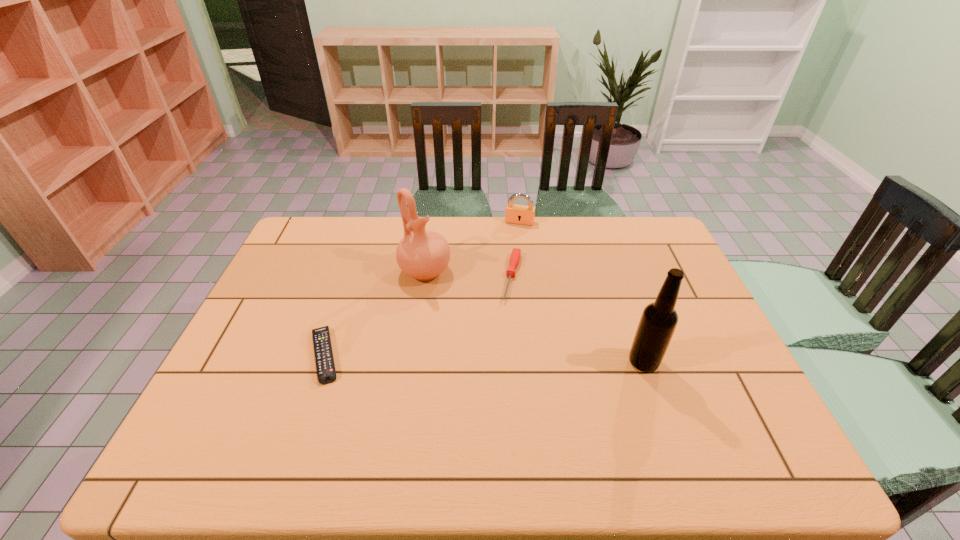
Find the location of a particular element. Image resolution: width=960 pixels, height=540 pixels. empty space between the remote control and the rightmost object is located at coordinates (484, 358).

Identify the location of unoccupied area between the fourth object from right to left and the shortest object. Image resolution: width=960 pixels, height=540 pixels. coord(375,313).

I want to click on unoccupied area between the pottery and the remote control, so click(375, 313).

Image resolution: width=960 pixels, height=540 pixels. What are the coordinates of `blank region between the rightmost object and the remote control` in the screenshot? It's located at (484, 358).

Identify which object is the third closest to the padlock. Please provide its 2D coordinates. Your answer should be formatted as a tuple, i.e. [(x, y)], where the tuple contains the x and y coordinates of a point satisfying the conditions above.

[(659, 319)]

Image resolution: width=960 pixels, height=540 pixels. In order to click on the closest object to the beer bottle in this screenshot , I will do `click(516, 253)`.

Where is `vacant space that satisfies the following two spatial constraints: 1. on the back side of the third shortest object; 2. on the left side of the second object from left to right`? The height and width of the screenshot is (540, 960). vacant space that satisfies the following two spatial constraints: 1. on the back side of the third shortest object; 2. on the left side of the second object from left to right is located at coordinates (432, 222).

Identify the location of free space that satisfies the following two spatial constraints: 1. on the back side of the remote control; 2. on the left side of the fourth object from right to left. (352, 272).